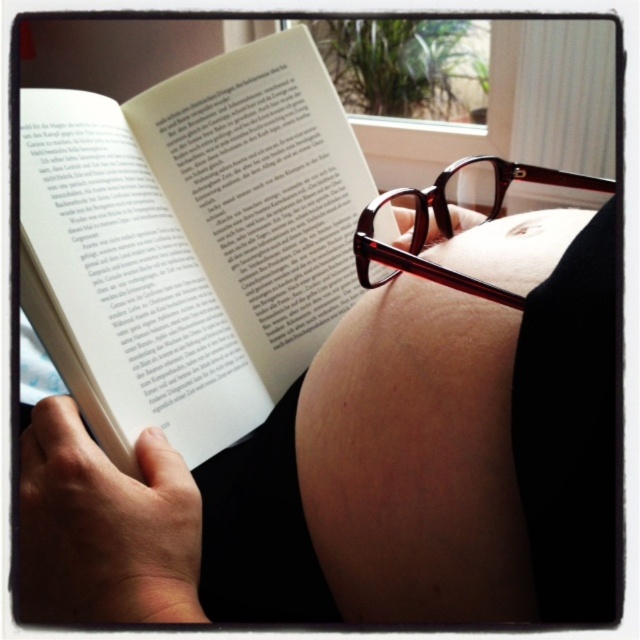
Measure the distance between point (291,314) and camera.

They are 54.62 centimeters apart.

Can you confirm if white paper at upper left is smaller than translucent tortoiseshell glasses at center?

No.

Identify the location of white paper at upper left. Image resolution: width=640 pixels, height=640 pixels. (189, 241).

Can you confirm if matte skin belly at center is positioned above translucent tortoiseshell glasses at center?

Incorrect, matte skin belly at center is not positioned above translucent tortoiseshell glasses at center.

Can you confirm if matte skin belly at center is positioned to the right of translucent tortoiseshell glasses at center?

In fact, matte skin belly at center is to the left of translucent tortoiseshell glasses at center.

Describe the element at coordinates (371, 464) in the screenshot. I see `matte skin belly at center` at that location.

The width and height of the screenshot is (640, 640). What are the coordinates of `matte skin belly at center` in the screenshot? It's located at (371, 464).

The image size is (640, 640). Find the location of `matte skin belly at center`. matte skin belly at center is located at coordinates (371, 464).

Consider the image. Is matte skin belly at center below white paper at upper left?

Yes.

Is point (464, 509) farther from camera compared to point (154, 410)?

That is False.

Where is `matte skin belly at center`? matte skin belly at center is located at coordinates (371, 464).